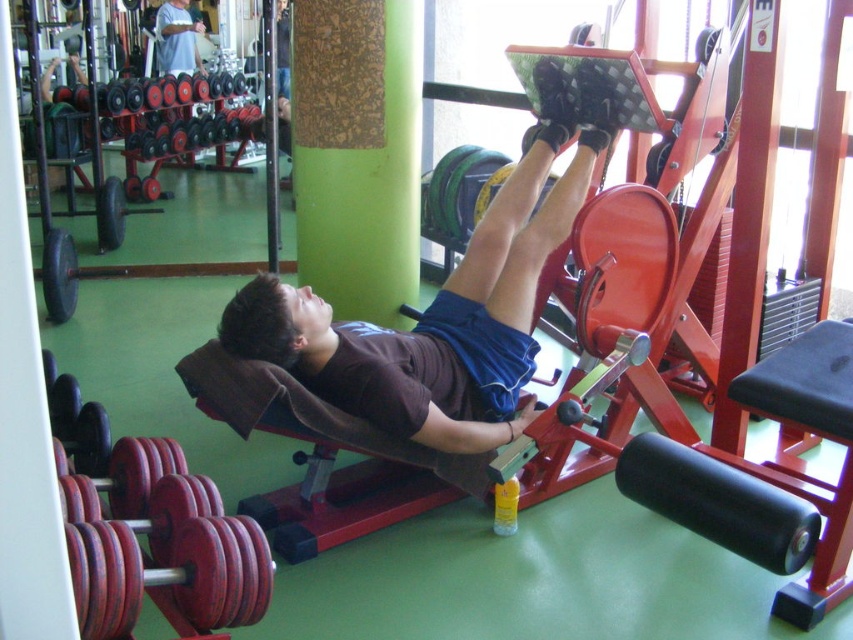
Consider the image. You are a gym trainer who needs to place a new equipment 3 meters away from the camera. Can you place it in the gym where the green cork at center is currently located?

The green cork at center is currently 3.49 meters away from the camera, which is slightly further than the desired 3 meters. Therefore, placing the new equipment exactly at the green cork at center would be too far, so you should move it closer by 0.49 meters.

You are a gym trainer observing the scene. You need to adjust the equipment so that the white cotton shirt at upper left does not block the green cork at center. Which object should you move and why?

You should move the white cotton shirt at upper left because it might be wider than the green cork at center, potentially obstructing the view of the green cork at center.

You are a gym trainer observing a client working out. The client is using the matte black leg press machine at center and wearing the white cotton shirt at upper left. Can you determine which object is bigger in size between the two?

The matte black leg press machine at center is larger in size than the white cotton shirt at upper left, so the leg press machine is bigger.